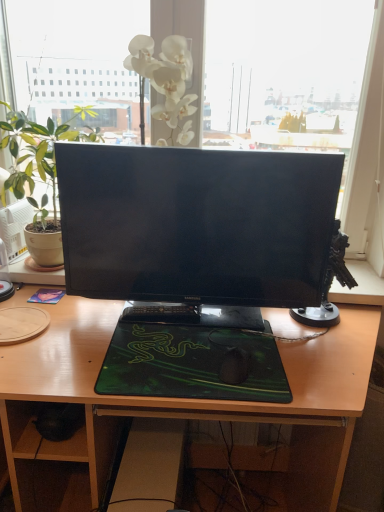
You are a GUI agent. You are given a task and a screenshot of the screen. Output one action in this format:
    pyautogui.click(x=<x>, y=<y>)
    Task: Click on the vacant region in front of black matte mouse at center
    This screenshot has height=512, width=384.
    Given the screenshot: What is the action you would take?
    pyautogui.click(x=245, y=392)